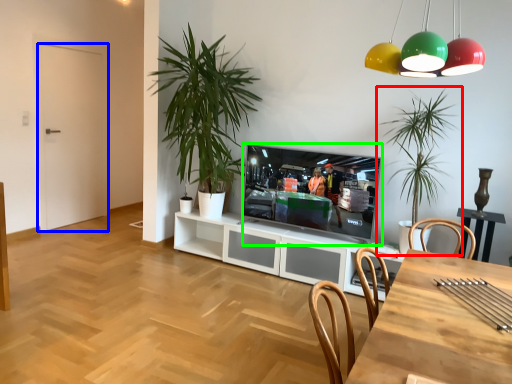
Question: Based on their relative distances, which object is nearer to houseplant (highlighted by a red box)? Choose from door (highlighted by a blue box) and television (highlighted by a green box).

Choices:
 (A) door
 (B) television

Answer: (B)